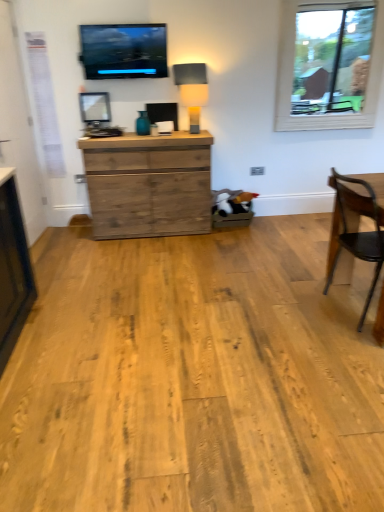
Question: Does wooden chair at right have a greater width compared to matte black screen at upper center?

Choices:
 (A) no
 (B) yes

Answer: (B)

Question: Does wooden chair at right turn towards matte black screen at upper center?

Choices:
 (A) yes
 (B) no

Answer: (B)

Question: Is wooden chair at right taller than matte black screen at upper center?

Choices:
 (A) no
 (B) yes

Answer: (B)

Question: Is wooden chair at right further to camera compared to matte black screen at upper center?

Choices:
 (A) no
 (B) yes

Answer: (A)

Question: From a real-world perspective, is wooden chair at right over matte black screen at upper center?

Choices:
 (A) yes
 (B) no

Answer: (B)

Question: Is wooden chair at right positioned far away from matte black screen at upper center?

Choices:
 (A) no
 (B) yes

Answer: (B)

Question: Can you confirm if matte black screen at upper center is smaller than matte beige lampshade at center?

Choices:
 (A) yes
 (B) no

Answer: (B)

Question: Is matte black screen at upper center oriented towards matte beige lampshade at center?

Choices:
 (A) yes
 (B) no

Answer: (B)

Question: Can you confirm if matte black screen at upper center is thinner than matte beige lampshade at center?

Choices:
 (A) yes
 (B) no

Answer: (A)

Question: Does matte black screen at upper center have a lesser height compared to matte beige lampshade at center?

Choices:
 (A) no
 (B) yes

Answer: (A)

Question: Would you consider matte black screen at upper center to be distant from matte beige lampshade at center?

Choices:
 (A) yes
 (B) no

Answer: (B)

Question: From a real-world perspective, is matte black screen at upper center below matte beige lampshade at center?

Choices:
 (A) no
 (B) yes

Answer: (A)

Question: Is there a large distance between rustic wood chest of drawers at center and matte beige lampshade at center?

Choices:
 (A) yes
 (B) no

Answer: (B)